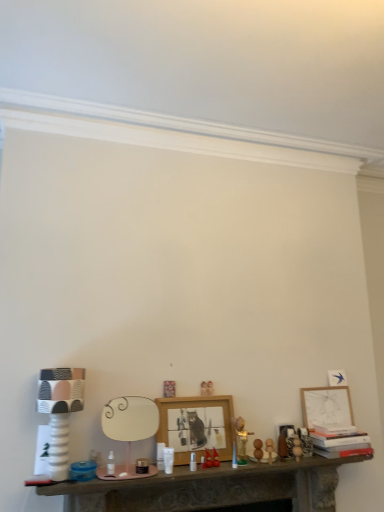
Question: Is point (66, 415) positioned closer to the camera than point (301, 454)?

Choices:
 (A) closer
 (B) farther

Answer: (A)

Question: Considering their positions, is white textured lamp at left located in front of or behind wooden ball at center, which ranks as the second toy in left-to-right order?

Choices:
 (A) front
 (B) behind

Answer: (A)

Question: Considering the real-world distances, which object is farthest from the smooth stone table at center?

Choices:
 (A) wooden ball at center, the 1th toy viewed from the right
 (B) white textured lamp at left
 (C) smooth wooden eggs at center, positioned as the first toy in left-to-right order
 (D) wooden picture frame at center, positioned as the first picture frame in front-to-back order
 (E) matte white picture frame at right, arranged as the 2th picture frame when viewed from the front

Answer: (E)

Question: Which of these objects is positioned farthest from the white textured lamp at left?

Choices:
 (A) smooth stone table at center
 (B) wooden picture frame at center, positioned as the first picture frame in front-to-back order
 (C) wooden ball at center, the 1th toy viewed from the right
 (D) matte white picture frame at right, the first picture frame from the back
 (E) smooth wooden eggs at center, arranged as the 2th toy when viewed from the right

Answer: (D)